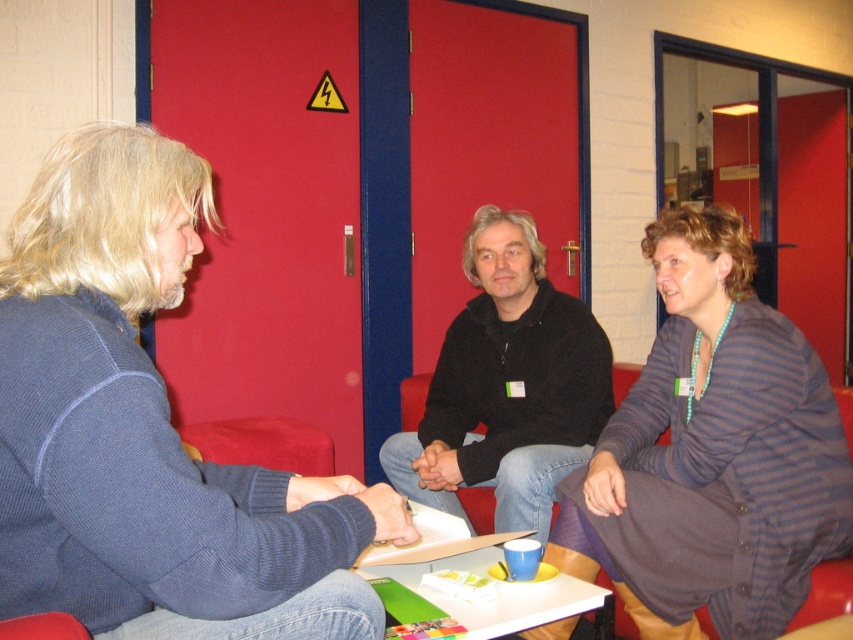
Question: Based on their relative distances, which object is farther from the blue fabric sweater at left?

Choices:
 (A) striped knit cardigan at center
 (B) brown fabric armchair at lower right
 (C) black matte jacket at center
 (D) white glossy table at center

Answer: (B)

Question: Which of the following is the closest to the observer?

Choices:
 (A) (434, 600)
 (B) (175, 202)

Answer: (B)

Question: Can you confirm if white glossy table at center is thinner than brown fabric armchair at lower right?

Choices:
 (A) yes
 (B) no

Answer: (B)

Question: In this image, where is blue fabric sweater at left located relative to striped knit cardigan at center?

Choices:
 (A) left
 (B) right

Answer: (A)

Question: Is the position of striped knit cardigan at center less distant than that of black matte jacket at center?

Choices:
 (A) no
 (B) yes

Answer: (B)

Question: Which object is the closest to the brown fabric armchair at lower right?

Choices:
 (A) black matte jacket at center
 (B) striped knit cardigan at center

Answer: (B)